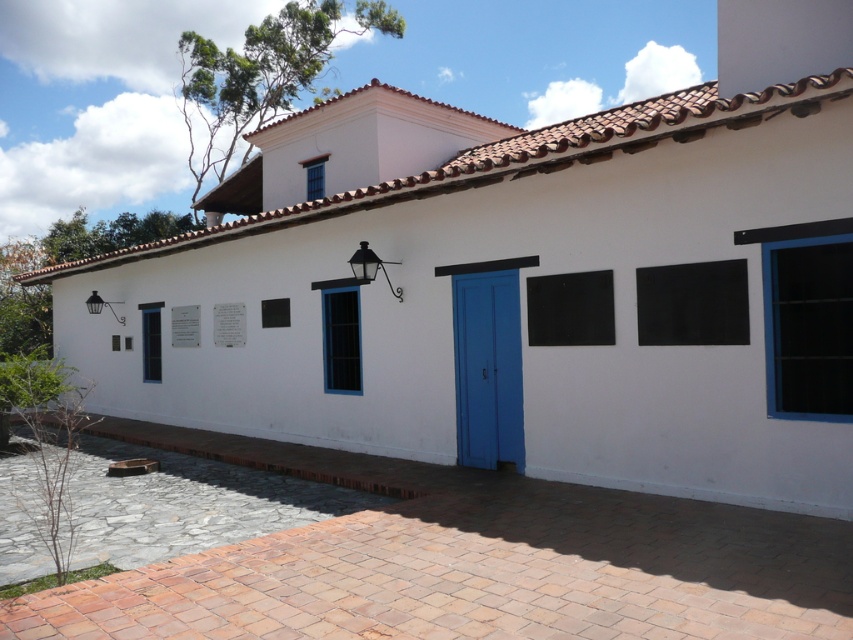
Question: Where is matte blue door at center located in relation to black matte shutter at left in the image?

Choices:
 (A) above
 (B) below

Answer: (B)

Question: Is black matte board at right closer to the viewer compared to black matte shutter at left?

Choices:
 (A) no
 (B) yes

Answer: (B)

Question: Which of these objects is positioned closest to the black matte board at right?

Choices:
 (A) brick paving at center
 (B) black glass window at center
 (C) black matte shutter at left
 (D) blue matte window at right

Answer: (D)

Question: Is brick paving at center smaller than blue matte window at right?

Choices:
 (A) yes
 (B) no

Answer: (B)

Question: Which of these objects is positioned farthest from the black matte board at center?

Choices:
 (A) black glass window at center
 (B) blue matte window at right

Answer: (A)

Question: Which of these objects is positioned closest to the black matte shutter at left?

Choices:
 (A) blue painted wood at upper center
 (B) black matte board at center

Answer: (A)